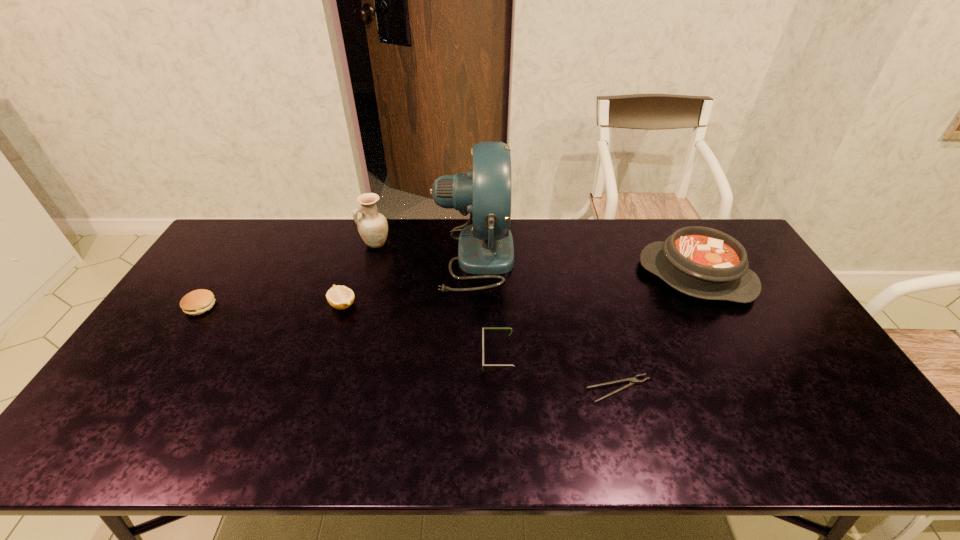
The image size is (960, 540). Identify the location of fan. (486, 248).

Where is `the second tallest object`? The width and height of the screenshot is (960, 540). the second tallest object is located at coordinates (372, 226).

You are a GUI agent. You are given a task and a screenshot of the screen. Output one action in this format:
    pyautogui.click(x=<x>, y=<y>)
    Task: Click on the third tallest object
    
    Given the screenshot: What is the action you would take?
    pyautogui.click(x=702, y=262)

Locate an element on the screen. The height and width of the screenshot is (540, 960). the rightmost object is located at coordinates 702,262.

The height and width of the screenshot is (540, 960). Identify the location of lemon. (340, 297).

I want to click on patty, so click(x=196, y=302).

The height and width of the screenshot is (540, 960). What are the coordinates of `spectacles` in the screenshot? It's located at (483, 365).

You are a GUI agent. You are given a task and a screenshot of the screen. Output one action in this format:
    pyautogui.click(x=<x>, y=<y>)
    Task: Click on the shortest object
    
    Given the screenshot: What is the action you would take?
    pyautogui.click(x=632, y=381)

This screenshot has width=960, height=540. I want to click on the sixth object from left to right, so click(x=632, y=381).

Locate an element on the screen. This screenshot has height=540, width=960. free space located 0.340m in front of the fan to blow air is located at coordinates (612, 256).